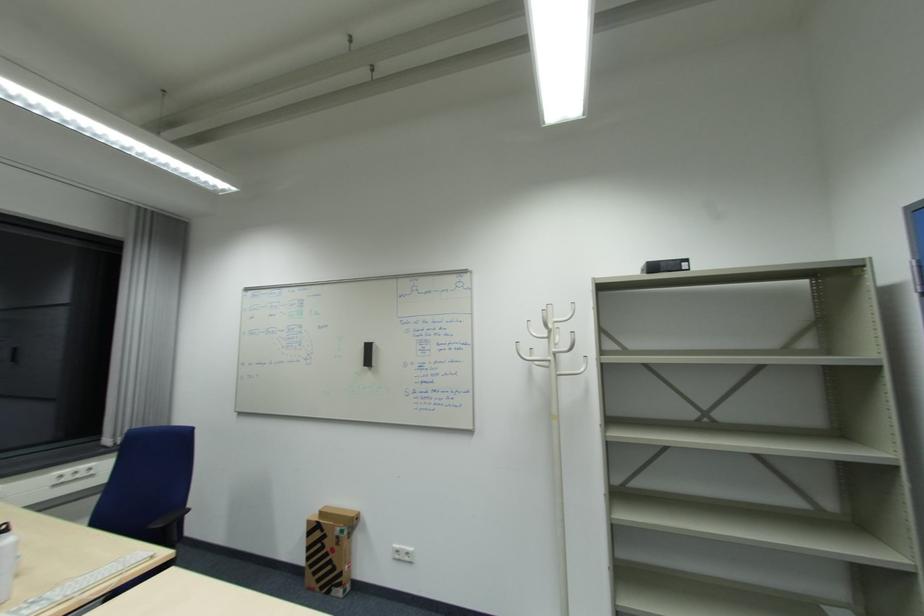
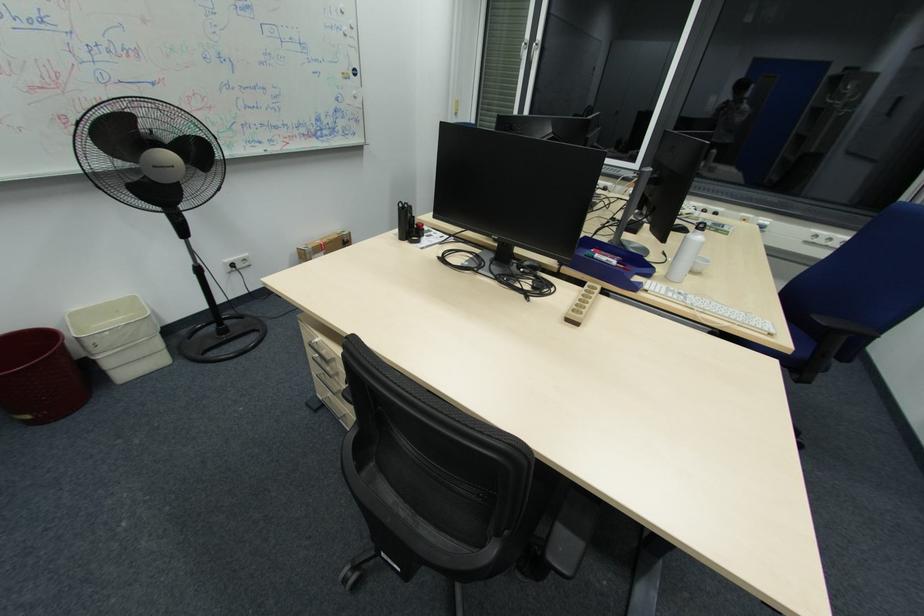
The first image is from the beginning of the video and the second image is from the end. How did the camera likely rotate when shooting the video?

The camera rotated toward left-down.